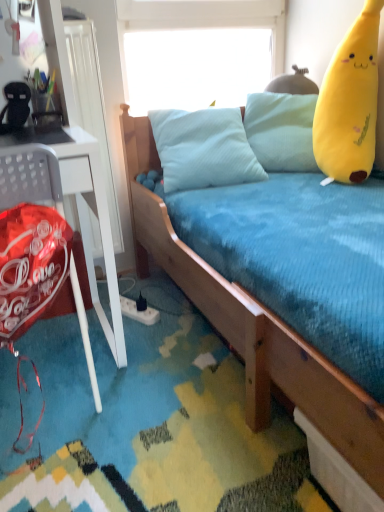
Question: Is point (54, 156) positioned closer to the camera than point (365, 397)?

Choices:
 (A) closer
 (B) farther

Answer: (B)

Question: Looking at the image, does shiny red balloon at left seem bigger or smaller compared to wooden bed at center?

Choices:
 (A) small
 (B) big

Answer: (A)

Question: Estimate the real-world distances between objects in this image. Which object is closer to the yellow plush toy at right?

Choices:
 (A) transparent plastic window screen at upper center
 (B) wooden bed at center
 (C) shiny red balloon at left

Answer: (A)

Question: Estimate the real-world distances between objects in this image. Which object is farther from the transparent plastic window screen at upper center?

Choices:
 (A) yellow plush toy at right
 (B) shiny red balloon at left
 (C) wooden bed at center

Answer: (B)